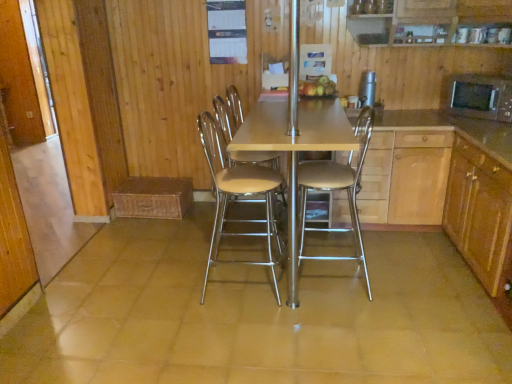
Where is `free point to the left of matte wooden table at center`? The width and height of the screenshot is (512, 384). free point to the left of matte wooden table at center is located at coordinates (131, 283).